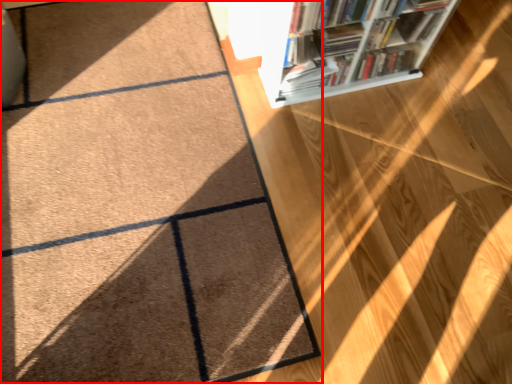
Question: In this image, where is doormat (annotated by the red box) located relative to bookcase?

Choices:
 (A) right
 (B) left

Answer: (B)